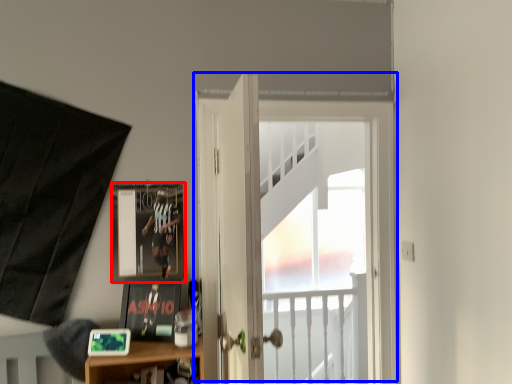
Question: Which of the following is the farthest to the observer, picture frame (highlighted by a red box) or door (highlighted by a blue box)?

Choices:
 (A) picture frame
 (B) door

Answer: (B)